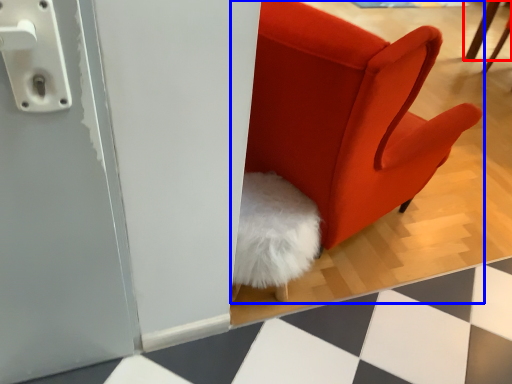
Question: Which of the following is the closest to the observer, furniture (highlighted by a red box) or chair (highlighted by a blue box)?

Choices:
 (A) furniture
 (B) chair

Answer: (B)